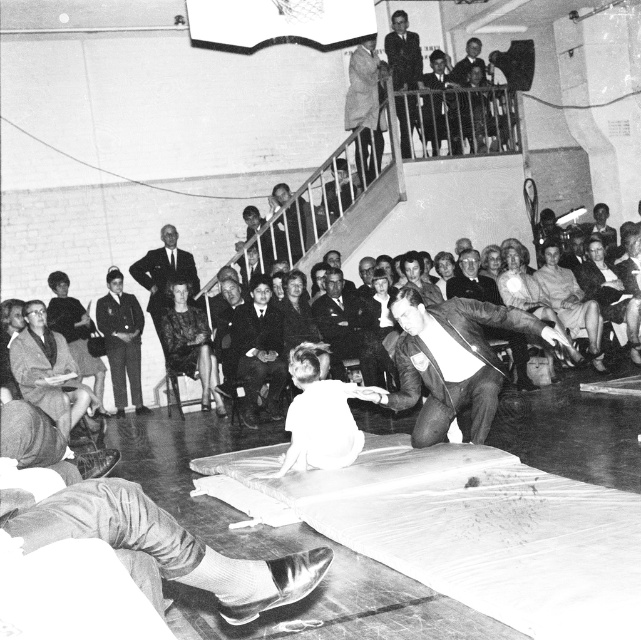
Question: Does velvet black dress at center appear on the right side of smooth leather jacket at upper center?

Choices:
 (A) yes
 (B) no

Answer: (B)

Question: Which of the following is the farthest from the observer?

Choices:
 (A) silky beige dress at center
 (B) smooth beige coat at upper center
 (C) dark gray suit at lower left

Answer: (B)

Question: Observing the image, what is the correct spatial positioning of silky beige dress at center in reference to formal suit at upper center?

Choices:
 (A) left
 (B) right

Answer: (B)

Question: Which of the following is the farthest from the observer?

Choices:
 (A) click(x=417, y=61)
 (B) click(x=171, y=246)
 (C) click(x=445, y=348)

Answer: (A)

Question: Among these points, which one is nearest to the camera?

Choices:
 (A) (370, 154)
 (B) (604, 317)
 (C) (178, 321)
 (D) (542, 257)

Answer: (C)

Question: Can you confirm if smooth fabric suit at lower left is smaller than silky beige dress at center?

Choices:
 (A) yes
 (B) no

Answer: (A)